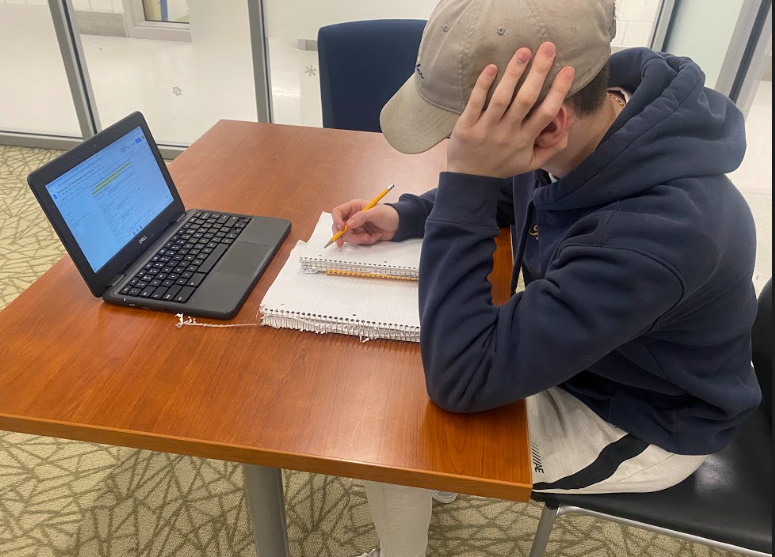
Locate an element on the screen. laptop is located at coordinates (219, 307).